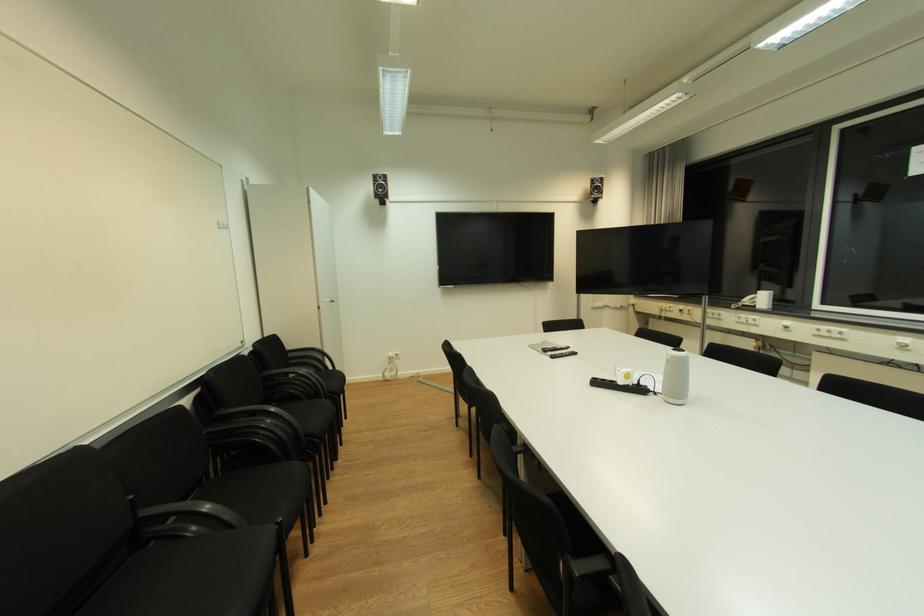
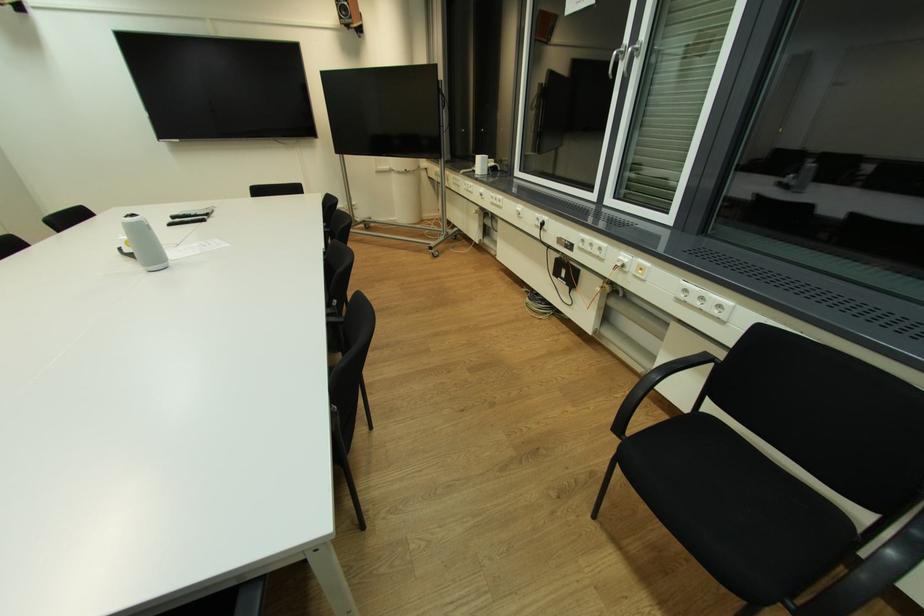
Locate, in the second image, the point that corresponds to (x=602, y=192) in the first image.

(349, 15)